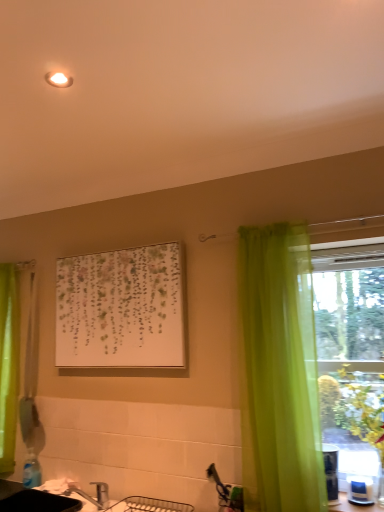
Identify the location of white glossy counter top at lower right. The width and height of the screenshot is (384, 512). (353, 506).

You are a GUI agent. You are given a task and a screenshot of the screen. Output one action in this format:
    pyautogui.click(x=<x>, y=<y>)
    Task: Click on the translucent green curtain at right, marked as the 1th curtain in a front-to-back arrangement
    
    Given the screenshot: What is the action you would take?
    pyautogui.click(x=279, y=372)

What is the approximate width of brushed metal faucet at lower left?

10.71 inches.

What do you see at coordinates (360, 411) in the screenshot? I see `green leafy plant at right` at bounding box center [360, 411].

Identify the location of black matte sink at lower left. (33, 500).

Locate an element on the screen. green sheer curtain at left, the 1th curtain positioned from the left is located at coordinates (9, 361).

Consider the image. How different are the orientations of green sheer curtain at left, marked as the second curtain in a right-to-left arrangement, and white matte picture frame at center in degrees?

green sheer curtain at left, marked as the second curtain in a right-to-left arrangement, and white matte picture frame at center are facing 1.11 degrees away from each other.

From a real-world perspective, is green sheer curtain at left, which is counted as the 1th curtain, starting from the back, above or below white matte picture frame at center?

green sheer curtain at left, which is counted as the 1th curtain, starting from the back, is below white matte picture frame at center.

From the image's perspective, does green sheer curtain at left, marked as the second curtain in a right-to-left arrangement, appear higher than white matte picture frame at center?

No.

Locate an element on the screen. the 2nd curtain directly beneath the white matte picture frame at center (from a real-world perspective) is located at coordinates (9, 361).

What's the angular difference between green sheer curtain at left, placed as the second curtain when sorted from front to back, and green leafy plant at right's facing directions?

1.64 degrees separate the facing orientations of green sheer curtain at left, placed as the second curtain when sorted from front to back, and green leafy plant at right.

In the scene shown: Looking at their sizes, would you say green sheer curtain at left, placed as the second curtain when sorted from front to back, is wider or thinner than green leafy plant at right?

Considering their sizes, green sheer curtain at left, placed as the second curtain when sorted from front to back, looks slimmer than green leafy plant at right.

I want to click on the 1st curtain above the green leafy plant at right (from a real-world perspective), so click(9, 361).

From a real-world perspective, does green sheer curtain at left, the 1th curtain positioned from the left, sit lower than green leafy plant at right?

No.

Would you say white matte picture frame at center is part of translucent green curtain at right, which is counted as the 2th curtain, starting from the back,'s contents?

No.

Considering the positions of objects translucent green curtain at right, which appears as the first curtain when viewed from the right, and white matte picture frame at center in the image provided, who is more to the left, translucent green curtain at right, which appears as the first curtain when viewed from the right, or white matte picture frame at center?

white matte picture frame at center is more to the left.

How many degrees apart are the facing directions of translucent green curtain at right, which appears as the first curtain when viewed from the right, and white matte picture frame at center?

The facing directions of translucent green curtain at right, which appears as the first curtain when viewed from the right, and white matte picture frame at center are 1.11 degrees apart.

From the image's perspective, which one is positioned higher, green leafy plant at right or translucent green curtain at right, arranged as the 2th curtain when viewed from the left?

translucent green curtain at right, arranged as the 2th curtain when viewed from the left, is shown above in the image.

From the picture: Is green leafy plant at right next to translucent green curtain at right, marked as the 1th curtain in a front-to-back arrangement, and touching it?

No, green leafy plant at right is not making contact with translucent green curtain at right, marked as the 1th curtain in a front-to-back arrangement.

Does green leafy plant at right contain translucent green curtain at right, which appears as the first curtain when viewed from the right?

No.

Which of these two, green leafy plant at right or translucent green curtain at right, which is counted as the 2th curtain, starting from the back, stands taller?

translucent green curtain at right, which is counted as the 2th curtain, starting from the back.

At what (x,y) coordinates should I click in order to perform the action: click on tap below the green leafy plant at right (from a real-world perspective). Please return your answer as a coordinate pair (x, y). Looking at the image, I should click on (89, 495).

Is point (377, 419) farther from viewer compared to point (81, 492)?

No, it is not.

Measure the distance from green leafy plant at right to brushed metal faucet at lower left.

green leafy plant at right is 4.05 feet from brushed metal faucet at lower left.

Choose the correct answer: Is green leafy plant at right inside brushed metal faucet at lower left or outside it?

green leafy plant at right is located beyond the bounds of brushed metal faucet at lower left.

Can you tell me how much white glossy counter top at lower right and black matte sink at lower left differ in facing direction?

The facing directions of white glossy counter top at lower right and black matte sink at lower left are 0.367 degrees apart.

Does white glossy counter top at lower right have a lesser width compared to black matte sink at lower left?

Indeed, white glossy counter top at lower right has a lesser width compared to black matte sink at lower left.

From the image's perspective, between white glossy counter top at lower right and black matte sink at lower left, which one is located above?

white glossy counter top at lower right, from the image's perspective.

Considering the positions of objects white glossy counter top at lower right and black matte sink at lower left in the image provided, who is more to the left, white glossy counter top at lower right or black matte sink at lower left?

black matte sink at lower left.

Image resolution: width=384 pixels, height=512 pixels. Identify the location of picture frame behind the green leafy plant at right. (121, 309).

Is point (72, 338) behind point (358, 389)?

Yes, it is behind point (358, 389).

Is white matte picture frame at center next to green leafy plant at right?

There is a gap between white matte picture frame at center and green leafy plant at right.

Consider the image. From the image's perspective, would you say white matte picture frame at center is positioned over green leafy plant at right?

Yes, from the image's perspective, white matte picture frame at center is over green leafy plant at right.

You are a GUI agent. You are given a task and a screenshot of the screen. Output one action in this format:
    pyautogui.click(x=<x>, y=<y>)
    Task: Click on the 2nd curtain below the white matte picture frame at center (from the image's perspective)
    The image size is (384, 512).
    Given the screenshot: What is the action you would take?
    pyautogui.click(x=9, y=361)

Find the location of a particular element. This screenshot has height=512, width=384. the 1st curtain directly above the green leafy plant at right (from a real-world perspective) is located at coordinates (9, 361).

From the image, which object appears to be nearer to green sheer curtain at left, placed as the second curtain when sorted from front to back, black matte sink at lower left or white glossy counter top at lower right?

black matte sink at lower left.

Which object lies further to the anchor point brushed metal faucet at lower left, white matte picture frame at center or green leafy plant at right?

Based on the image, green leafy plant at right appears to be further to brushed metal faucet at lower left.

Which object lies further to the anchor point white glossy counter top at lower right, brushed metal faucet at lower left or translucent green curtain at right, which is counted as the 2th curtain, starting from the back?

brushed metal faucet at lower left lies further to white glossy counter top at lower right than the other object.

Based on the photo, when comparing their distances from white glossy counter top at lower right, does green sheer curtain at left, placed as the second curtain when sorted from front to back, or white matte picture frame at center seem further?

The object further to white glossy counter top at lower right is green sheer curtain at left, placed as the second curtain when sorted from front to back.

When comparing their distances from translucent green curtain at right, which is counted as the 2th curtain, starting from the back, does green sheer curtain at left, which is counted as the 1th curtain, starting from the back, or green leafy plant at right seem further?

Among the two, green sheer curtain at left, which is counted as the 1th curtain, starting from the back, is located further to translucent green curtain at right, which is counted as the 2th curtain, starting from the back.

From the image, which object appears to be nearer to green sheer curtain at left, marked as the second curtain in a right-to-left arrangement, green leafy plant at right or white glossy counter top at lower right?

Based on the image, green leafy plant at right appears to be nearer to green sheer curtain at left, marked as the second curtain in a right-to-left arrangement.

Looking at the image, which one is located further to translucent green curtain at right, which appears as the first curtain when viewed from the right, black matte sink at lower left or brushed metal faucet at lower left?

Based on the image, black matte sink at lower left appears to be further to translucent green curtain at right, which appears as the first curtain when viewed from the right.

Estimate the real-world distances between objects in this image. Which object is further from white matte picture frame at center, green sheer curtain at left, placed as the second curtain when sorted from front to back, or black matte sink at lower left?

Among the two, black matte sink at lower left is located further to white matte picture frame at center.

Where is `curtain between green sheer curtain at left, the 1th curtain positioned from the left, and white glossy counter top at lower right, in the horizontal direction`? curtain between green sheer curtain at left, the 1th curtain positioned from the left, and white glossy counter top at lower right, in the horizontal direction is located at coordinates (279, 372).

You are a GUI agent. You are given a task and a screenshot of the screen. Output one action in this format:
    pyautogui.click(x=<x>, y=<y>)
    Task: Click on the counter top between black matte sink at lower left and green leafy plant at right in the horizontal direction
    The image size is (384, 512).
    Given the screenshot: What is the action you would take?
    pyautogui.click(x=353, y=506)

Find the location of a particular element. The image size is (384, 512). sink between green sheer curtain at left, marked as the second curtain in a right-to-left arrangement, and brushed metal faucet at lower left, in the horizontal direction is located at coordinates (33, 500).

This screenshot has width=384, height=512. Find the location of `tap between green sheer curtain at left, marked as the second curtain in a right-to-left arrangement, and white glossy counter top at lower right`. tap between green sheer curtain at left, marked as the second curtain in a right-to-left arrangement, and white glossy counter top at lower right is located at coordinates (89, 495).